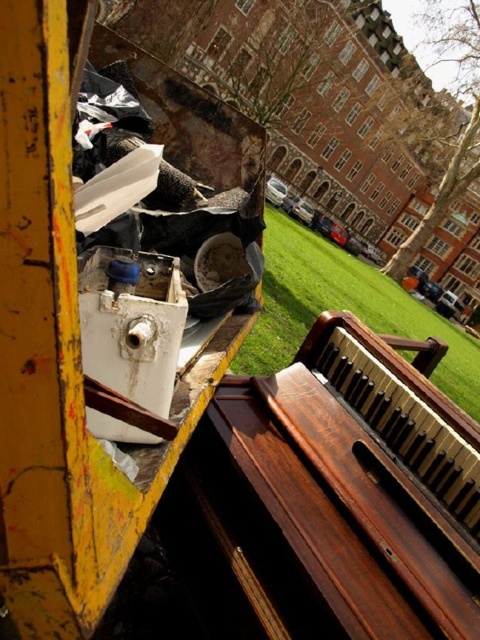
Is wooden polished piano at lower right further to camera compared to green grass at center?

No, it is in front of green grass at center.

Which is in front, point (454, 515) or point (336, 308)?

Point (454, 515) is in front.

What are the coordinates of `wooden polished piano at lower right` in the screenshot? It's located at (345, 492).